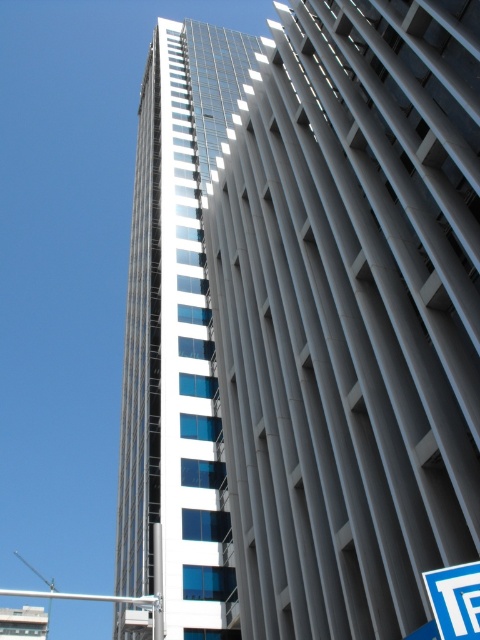
You are standing in front of the modern high rise and want to take a photo of the smooth glass building at center and the blue plastic street sign at lower right. Which object is closer to your camera lens?

The smooth glass building at center is closer to the camera lens because it is further to the viewer than the blue plastic street sign at lower right.

From the picture: You are standing in front of a modern highrise building. You notice a smooth glass building at center and a silver metallic pole at center. Which object is closer to you?

The smooth glass building at center is closer to you because it is in front of the silver metallic pole at center.

You are standing at the base of the modern high rise building and want to reach a specific point marked at coordinates point (416, 419). Given that the building is 150 meters tall, can you estimate how far you need to walk horizontally to reach that point from your current position?

The point (416, 419) is 27.19 meters away from the camera, so you need to walk approximately 27.19 meters horizontally to reach that point from your current position.